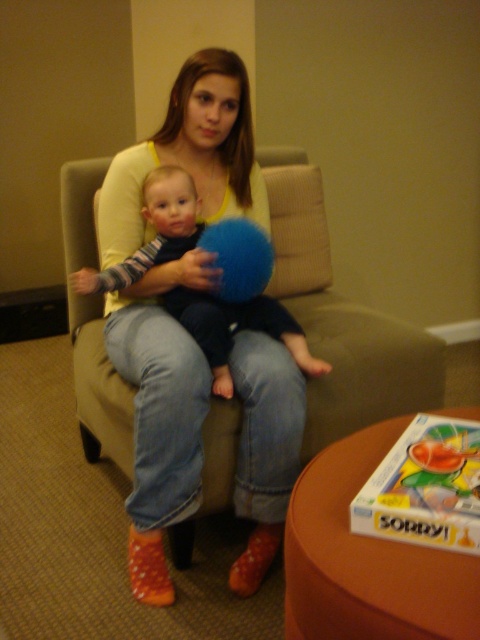
Question: Which point appears closest to the camera in this image?

Choices:
 (A) (316, 364)
 (B) (243, 266)
 (C) (156, 355)

Answer: (C)

Question: Is matte yellow sweater at center to the left of soft blue plush at center from the viewer's perspective?

Choices:
 (A) yes
 (B) no

Answer: (B)

Question: Considering the relative positions of matte yellow sweater at center and blue fuzzy ball at center in the image provided, where is matte yellow sweater at center located with respect to blue fuzzy ball at center?

Choices:
 (A) below
 (B) above

Answer: (A)

Question: Does matte yellow sweater at center appear under blue fuzzy ball at center?

Choices:
 (A) yes
 (B) no

Answer: (A)

Question: Which point is farther from the camera taking this photo?

Choices:
 (A) (145, 332)
 (B) (226, 248)

Answer: (B)

Question: Estimate the real-world distances between objects in this image. Which object is farther from the blue fuzzy ball at center?

Choices:
 (A) soft blue plush at center
 (B) matte yellow sweater at center

Answer: (B)